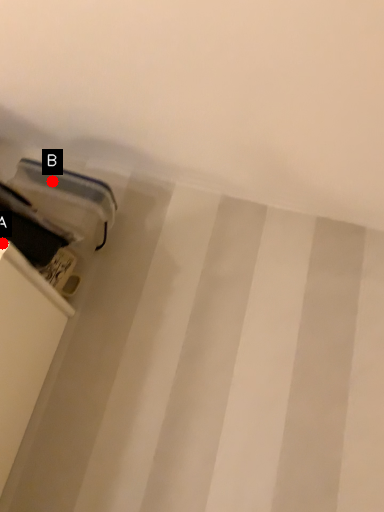
Question: Two points are circled on the image, labeled by A and B beside each circle. Which of the following is the closest to the observer?

Choices:
 (A) A is closer
 (B) B is closer

Answer: (A)